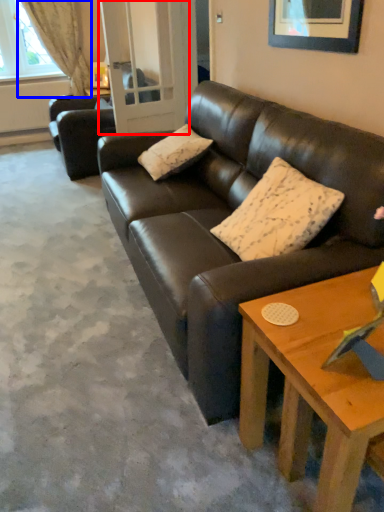
Question: Which of the following is the closest to the observer, glass door (highlighted by a red box) or curtain (highlighted by a blue box)?

Choices:
 (A) glass door
 (B) curtain

Answer: (A)